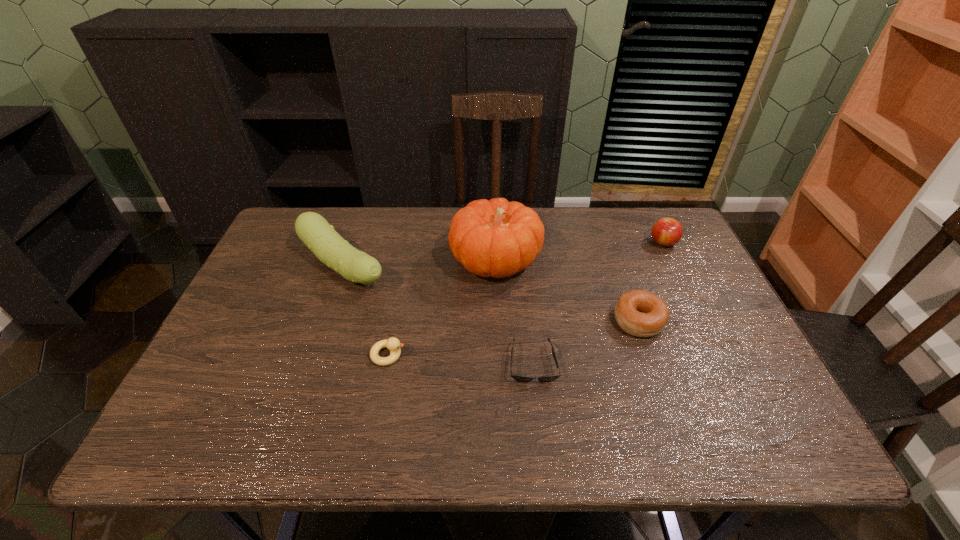
Find the location of `pumpkin`. pumpkin is located at coordinates (497, 238).

Find the location of a particular element. The image size is (960, 540). cucumber is located at coordinates pyautogui.click(x=317, y=234).

The height and width of the screenshot is (540, 960). I want to click on the rightmost object, so click(x=666, y=232).

This screenshot has height=540, width=960. In order to click on apple in this screenshot , I will do pos(666,232).

This screenshot has height=540, width=960. Identify the location of bagel. (640, 313).

The height and width of the screenshot is (540, 960). What are the coordinates of `the third nearest object` in the screenshot? It's located at (640, 313).

At what (x,y) coordinates should I click in order to perform the action: click on duckling. Please return your answer as a coordinate pair (x, y). This screenshot has height=540, width=960. Looking at the image, I should click on (393, 344).

Locate an element on the screen. This screenshot has height=540, width=960. the shortest object is located at coordinates (521, 378).

At what (x,y) coordinates should I click in order to perform the action: click on free space located on the front of the tallest object. Please return your answer as a coordinate pair (x, y). The height and width of the screenshot is (540, 960). Looking at the image, I should click on (498, 329).

At what (x,y) coordinates should I click in order to perform the action: click on free space located on the front of the cucumber. Please return your answer as a coordinate pair (x, y). This screenshot has width=960, height=540. Looking at the image, I should click on (295, 408).